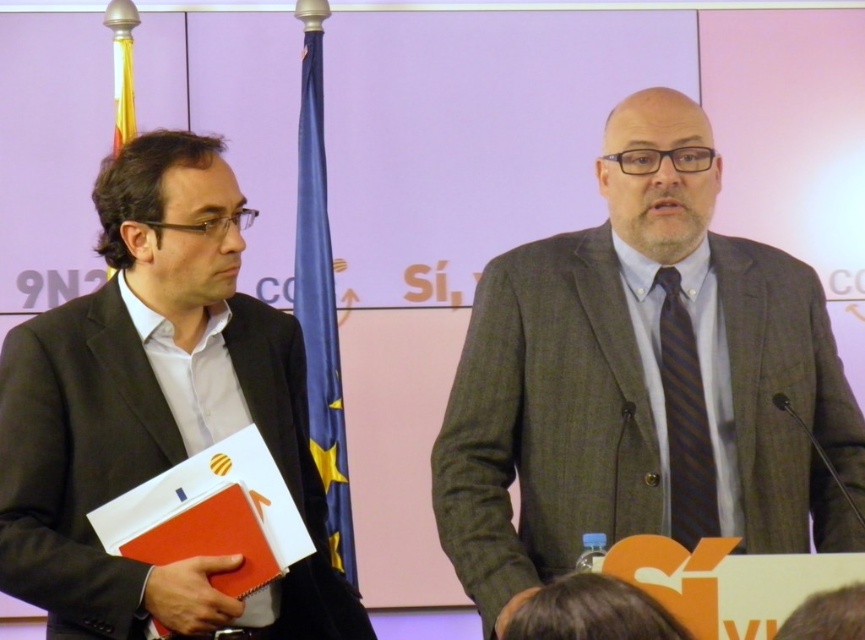
You are a photographer at the event and need to capture a clear shot of both the matte black suit at left and the dark blue striped tie at center. Which object is positioned closer to the camera?

The matte black suit at left is closer to the viewer than the dark blue striped tie at center, so it will appear closer to the camera.

You are an event organizer who needs to arrange a photo shoot. You have to position a gray wool suit at center and a dark blue striped tie at center in the frame. Based on their sizes, which object should be placed closer to the camera to ensure both are visible in the photo?

The gray wool suit at center is much taller than the dark blue striped tie at center. To ensure both are visible in the photo, the dark blue striped tie at center should be placed closer to the camera so that its size matches the gray wool suit at center in the frame.

You are an event planner who needs to arrange seating for a photo opportunity. The two individuals wearing the gray wool suit at center and the matte black suit at left are to be seated side by side. Given that the chairs are 4 feet apart, will there be enough space between them?

The gray wool suit at center and matte black suit at left are 4.12 feet apart, so the chairs placed 4 feet apart would be slightly closer than their current standing distance. However, 4 feet is still a reasonable distance for seating, so it should be sufficient.